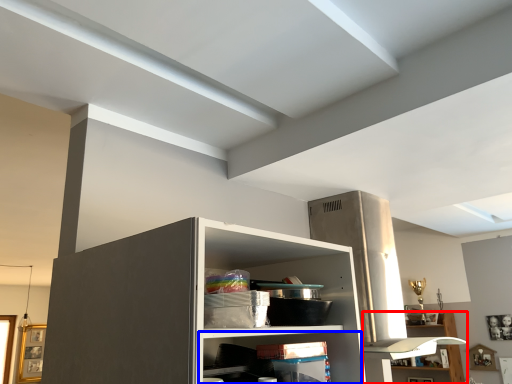
Question: Which of the following is the closest to the observer, shelf (highlighted by a red box) or shelf (highlighted by a blue box)?

Choices:
 (A) shelf
 (B) shelf

Answer: (B)